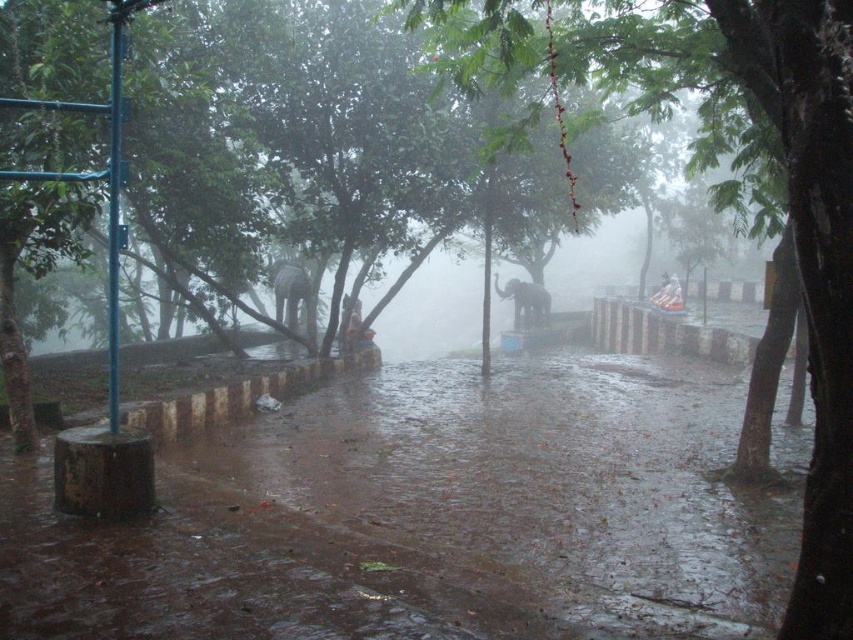
Question: Which point is closer to the camera?

Choices:
 (A) (669, 300)
 (B) (544, 316)
 (C) (747, 8)

Answer: (C)

Question: Is wet concrete flood at lower center wider than green leafy tree at center?

Choices:
 (A) no
 (B) yes

Answer: (B)

Question: Where is wet concrete flood at lower center located in relation to matte gray elephant at center in the image?

Choices:
 (A) right
 (B) left

Answer: (B)

Question: Estimate the real-world distances between objects in this image. Which object is farther from the matte gray elephant at center?

Choices:
 (A) green leafy tree at center
 (B) wet concrete flood at lower center
 (C) white plastic bag at center

Answer: (B)

Question: Can you confirm if matte gray elephant at center is positioned to the right of white plastic bag at center?

Choices:
 (A) yes
 (B) no

Answer: (B)

Question: Which of the following is the closest to the observer?

Choices:
 (A) wet concrete flood at lower center
 (B) white plastic bag at center

Answer: (A)